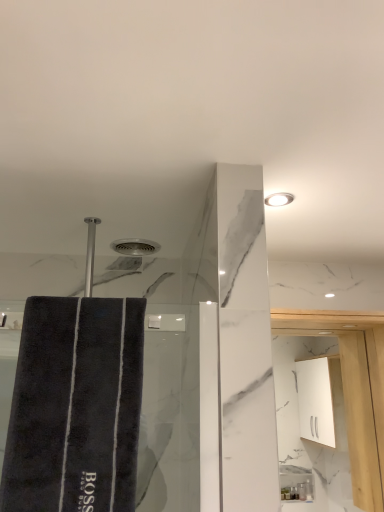
Question: Is dark gray plush bath towel at left in front of white glossy cabinet at upper right?

Choices:
 (A) no
 (B) yes

Answer: (B)

Question: Considering the relative sizes of dark gray plush bath towel at left and white glossy cabinet at upper right in the image provided, is dark gray plush bath towel at left smaller than white glossy cabinet at upper right?

Choices:
 (A) yes
 (B) no

Answer: (B)

Question: Is dark gray plush bath towel at left positioned far away from white glossy cabinet at upper right?

Choices:
 (A) no
 (B) yes

Answer: (A)

Question: Can you confirm if dark gray plush bath towel at left is thinner than white glossy cabinet at upper right?

Choices:
 (A) no
 (B) yes

Answer: (A)

Question: Considering the relative sizes of dark gray plush bath towel at left and white glossy cabinet at upper right in the image provided, is dark gray plush bath towel at left wider than white glossy cabinet at upper right?

Choices:
 (A) yes
 (B) no

Answer: (A)

Question: From the image's perspective, relative to white glossy light fixture at upper right, is white glossy cabinet at upper right above or below?

Choices:
 (A) below
 (B) above

Answer: (A)

Question: From a real-world perspective, is white glossy cabinet at upper right positioned above or below white glossy light fixture at upper right?

Choices:
 (A) below
 (B) above

Answer: (A)

Question: Considering the relative positions of white glossy cabinet at upper right and white glossy light fixture at upper right in the image provided, is white glossy cabinet at upper right to the left or to the right of white glossy light fixture at upper right?

Choices:
 (A) left
 (B) right

Answer: (B)

Question: In terms of height, does white glossy cabinet at upper right look taller or shorter compared to white glossy light fixture at upper right?

Choices:
 (A) tall
 (B) short

Answer: (A)

Question: Based on their positions, is dark gray plush bath towel at left located to the left or right of white glossy cabinet at upper right?

Choices:
 (A) left
 (B) right

Answer: (A)

Question: Do you think dark gray plush bath towel at left is within white glossy cabinet at upper right, or outside of it?

Choices:
 (A) inside
 (B) outside

Answer: (B)

Question: Considering the positions of dark gray plush bath towel at left and white glossy cabinet at upper right in the image, is dark gray plush bath towel at left bigger or smaller than white glossy cabinet at upper right?

Choices:
 (A) small
 (B) big

Answer: (B)

Question: Relative to white glossy cabinet at upper right, is dark gray plush bath towel at left in front or behind?

Choices:
 (A) behind
 (B) front

Answer: (B)

Question: Based on their positions, is white glossy light fixture at upper right located to the left or right of dark gray plush bath towel at left?

Choices:
 (A) right
 (B) left

Answer: (A)

Question: In terms of size, does white glossy light fixture at upper right appear bigger or smaller than dark gray plush bath towel at left?

Choices:
 (A) small
 (B) big

Answer: (A)